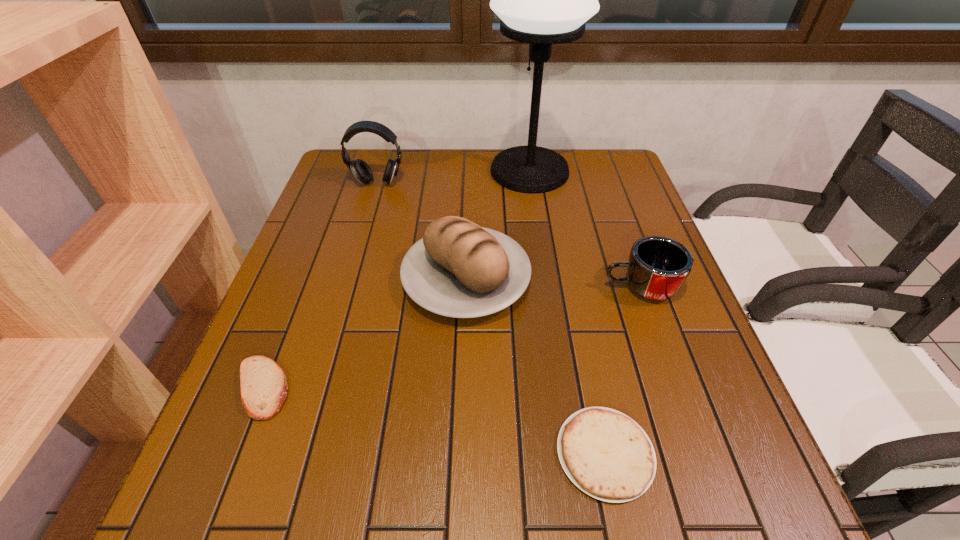
The image size is (960, 540). Find the location of `the tallest object`. the tallest object is located at coordinates (542, 0).

What are the coordinates of `earphone` in the screenshot? It's located at (361, 170).

The image size is (960, 540). I want to click on bread, so click(x=459, y=269).

The height and width of the screenshot is (540, 960). Find the location of `mug`. mug is located at coordinates (658, 266).

Locate an element on the screen. Image resolution: width=960 pixels, height=540 pixels. pita bread is located at coordinates (263, 384).

This screenshot has width=960, height=540. I want to click on tortilla, so click(x=606, y=454).

Locate an element on the screen. The height and width of the screenshot is (540, 960). vacant space located 0.300m on the front of the tallest object is located at coordinates (544, 269).

What are the coordinates of `vacant area situated on the ear cups of the earphone` in the screenshot? It's located at (367, 218).

You are a GUI agent. You are given a task and a screenshot of the screen. Output one action in this format:
    pyautogui.click(x=<x>, y=<y>)
    Task: Click on the free space located on the front of the bread
    
    Given the screenshot: What is the action you would take?
    pyautogui.click(x=464, y=357)

Image resolution: width=960 pixels, height=540 pixels. What are the coordinates of `free space located on the side of the mug with the handle` in the screenshot? It's located at (549, 288).